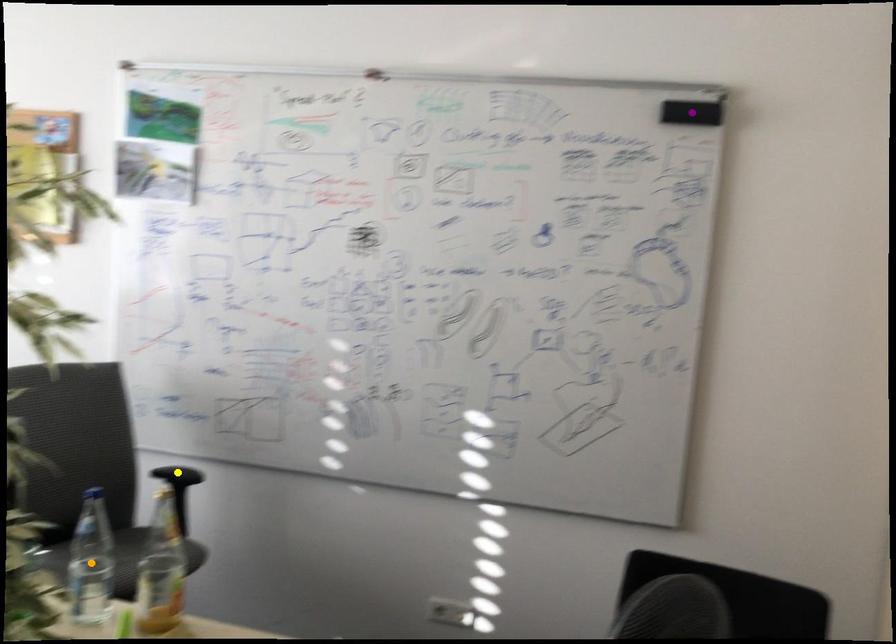
Order these from nearest to farthest:
- yellow point
- orange point
- purple point

orange point → purple point → yellow point